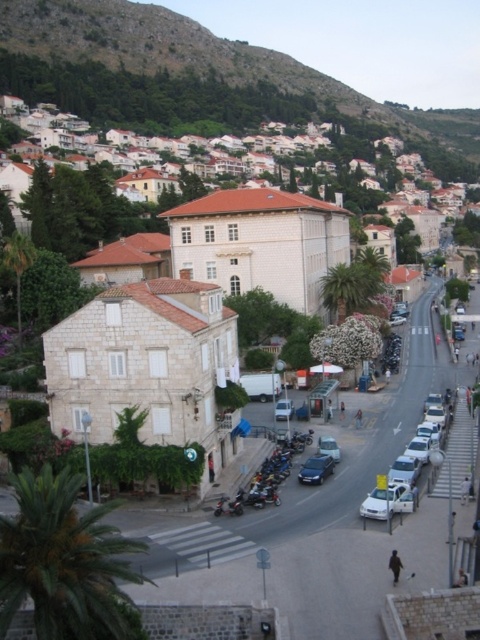
Can you confirm if green leafy palm tree at lower left is positioned to the left of white matte car at lower right?

Yes, green leafy palm tree at lower left is to the left of white matte car at lower right.

Does point (95, 552) lie behind point (380, 509)?

No, (95, 552) is closer to viewer.

Where is `green leafy palm tree at lower left`? Image resolution: width=480 pixels, height=640 pixels. green leafy palm tree at lower left is located at coordinates (66, 563).

I want to click on green leafy palm tree at left, so click(x=17, y=262).

Looking at this image, measure the distance between green leafy palm tree at left and camera.

They are 61.22 meters apart.

Where is `green leafy palm tree at left`? The width and height of the screenshot is (480, 640). green leafy palm tree at left is located at coordinates (17, 262).

Is green leafy hillside at upper left shorter than green leafy palm tree at left?

No, green leafy hillside at upper left is not shorter than green leafy palm tree at left.

Does green leafy hillside at upper left have a greater height compared to green leafy palm tree at left?

Yes.

Is point (76, 90) closer to camera compared to point (16, 312)?

That is False.

Identify the location of green leafy hillside at upper left. (201, 70).